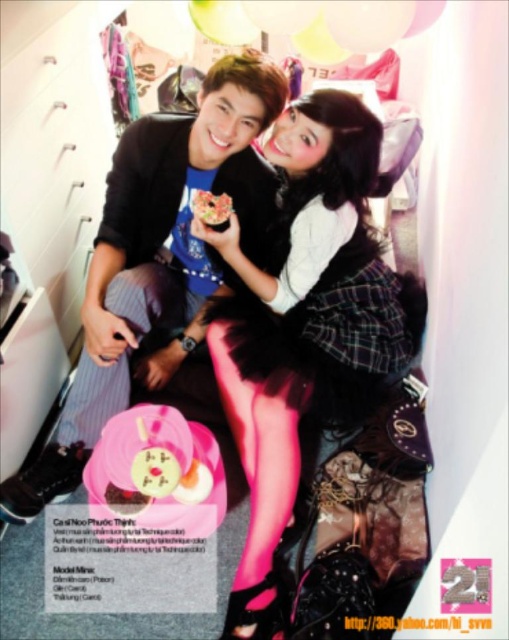
Between matte black sweater at center and smooth chocolate bar at center, which one appears on the left side from the viewer's perspective?

matte black sweater at center is more to the left.

Is matte black sweater at center positioned before smooth chocolate bar at center?

Yes.

Between point (94, 369) and point (225, 227), which one is positioned behind?

The point (225, 227) is behind.

The width and height of the screenshot is (509, 640). In order to click on matte black sweater at center in this screenshot , I will do `click(156, 259)`.

Is pink tulle skirt at center thinner than matte black sweater at center?

Indeed, pink tulle skirt at center has a lesser width compared to matte black sweater at center.

Describe the element at coordinates (306, 324) in the screenshot. I see `pink tulle skirt at center` at that location.

At what (x,y) coordinates should I click in order to perform the action: click on pink tulle skirt at center. Please return your answer as a coordinate pair (x, y). Image resolution: width=509 pixels, height=640 pixels. Looking at the image, I should click on (306, 324).

Does point (257, 272) come in front of point (206, 225)?

No, (257, 272) is behind (206, 225).

Can you confirm if pink tulle skirt at center is positioned above smooth chocolate bar at center?

No, pink tulle skirt at center is not above smooth chocolate bar at center.

Is point (288, 275) positioned behind point (213, 205)?

That is True.

This screenshot has height=640, width=509. Identify the location of pink tulle skirt at center. (306, 324).